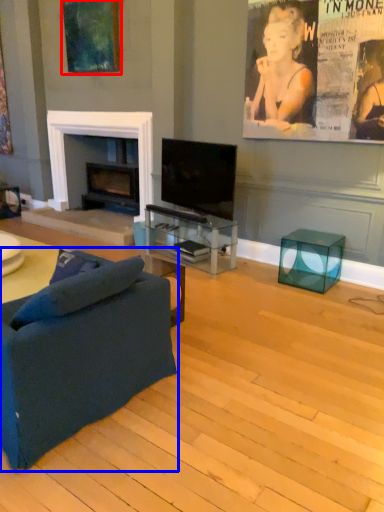
Question: Among these objects, which one is farthest to the camera, picture frame (highlighted by a red box) or studio couch (highlighted by a blue box)?

Choices:
 (A) picture frame
 (B) studio couch

Answer: (A)